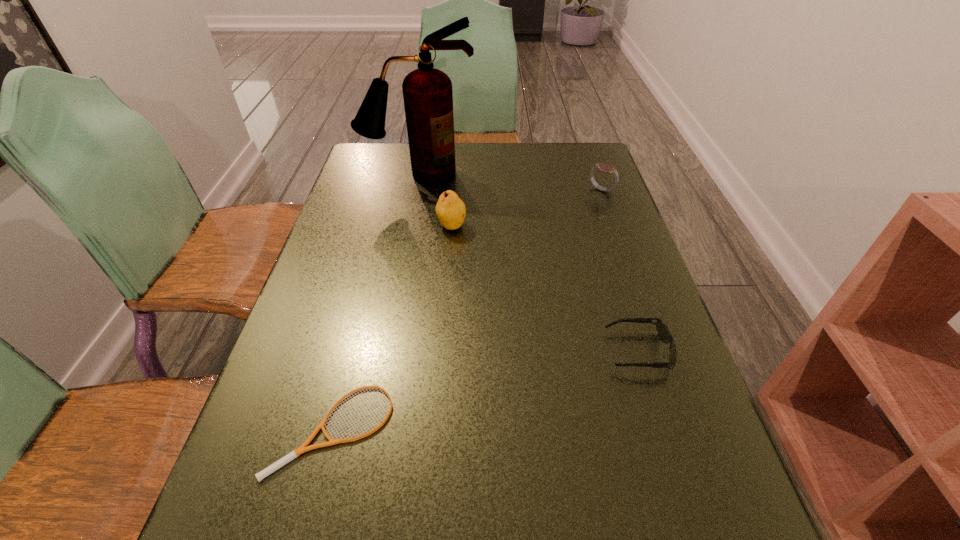
The height and width of the screenshot is (540, 960). In order to click on free point that satisfies the following two spatial constraints: 1. at the nozzle of the watch; 2. on the left side of the fire extinguisher in this screenshot , I will do `click(416, 190)`.

The image size is (960, 540). Find the location of `vacant space that satisfies the following two spatial constraints: 1. on the back side of the third farthest object; 2. on the left side of the nearest object`. vacant space that satisfies the following two spatial constraints: 1. on the back side of the third farthest object; 2. on the left side of the nearest object is located at coordinates (386, 226).